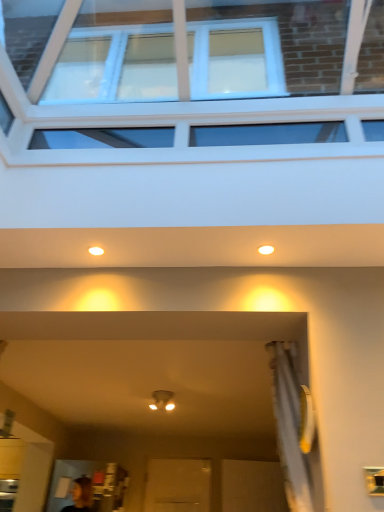
Question: Do you think matte white light fixture at center is within clear glass window at upper center, or outside of it?

Choices:
 (A) outside
 (B) inside

Answer: (A)

Question: In the image, is matte white light fixture at center on the left side or the right side of clear glass window at upper center?

Choices:
 (A) left
 (B) right

Answer: (A)

Question: Considering the real-world distances, which object is farthest from the clear glass window at upper center?

Choices:
 (A) matte white light fixture at center
 (B) matte white light fixture at upper center, which is the 2th lighting from right to left
 (C) matte white light fixture at upper center, which is the second lighting from left to right

Answer: (A)

Question: Estimate the real-world distances between objects in this image. Which object is closer to the matte white light fixture at upper center, marked as the first lighting in a left-to-right arrangement?

Choices:
 (A) matte white light fixture at upper center, the 1th lighting positioned from the right
 (B) matte white light fixture at center
 (C) clear glass window at upper center

Answer: (A)